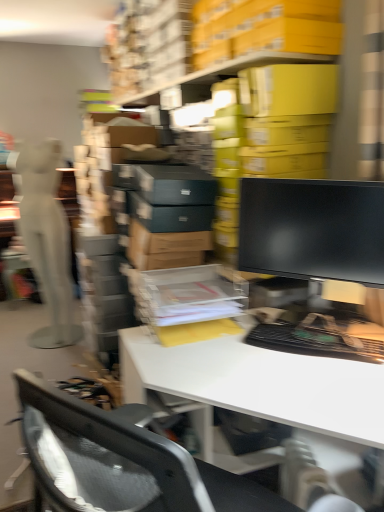
Identify the location of free space above white glossy desk at center (from a real-world perspective). (280, 360).